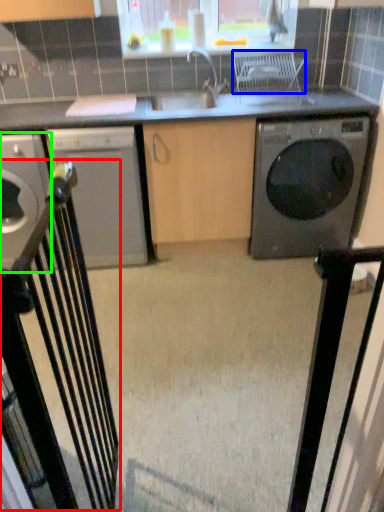
Question: Which object is positioned closest to chair (highlighted by a red box)? Select from chair (highlighted by a blue box) and home appliance (highlighted by a green box).

Choices:
 (A) chair
 (B) home appliance

Answer: (B)